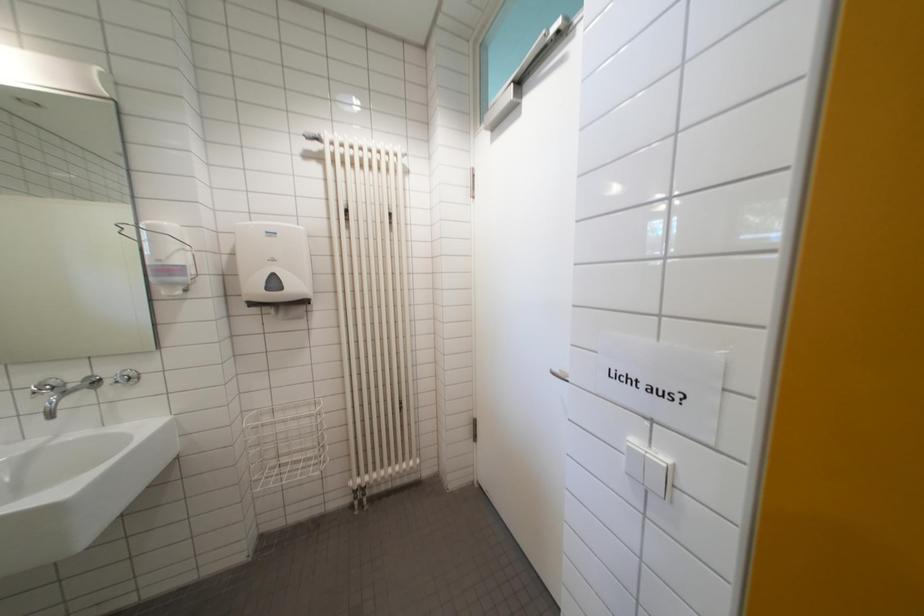
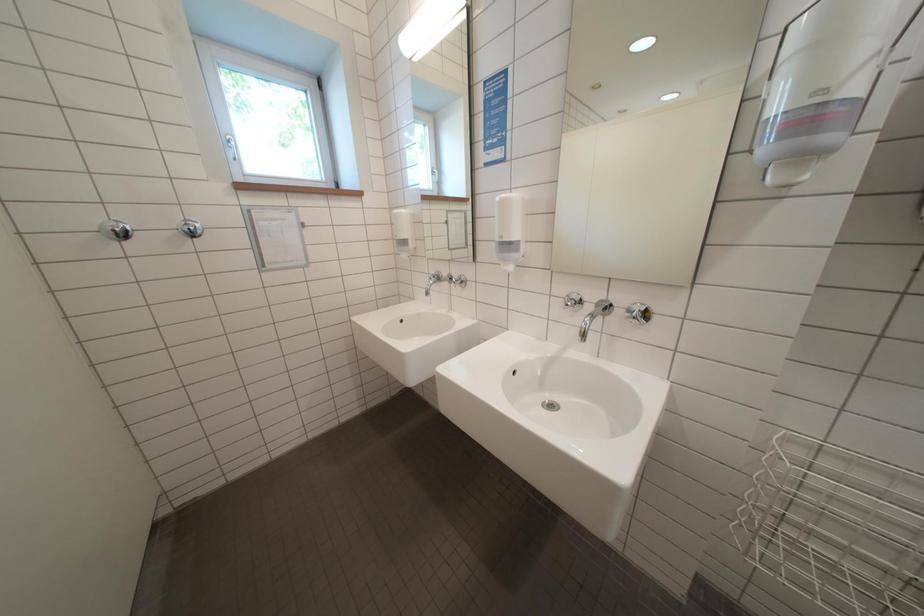
The first image is from the beginning of the video and the second image is from the end. How did the camera likely rotate when shooting the video?

The camera rotated toward left-down.